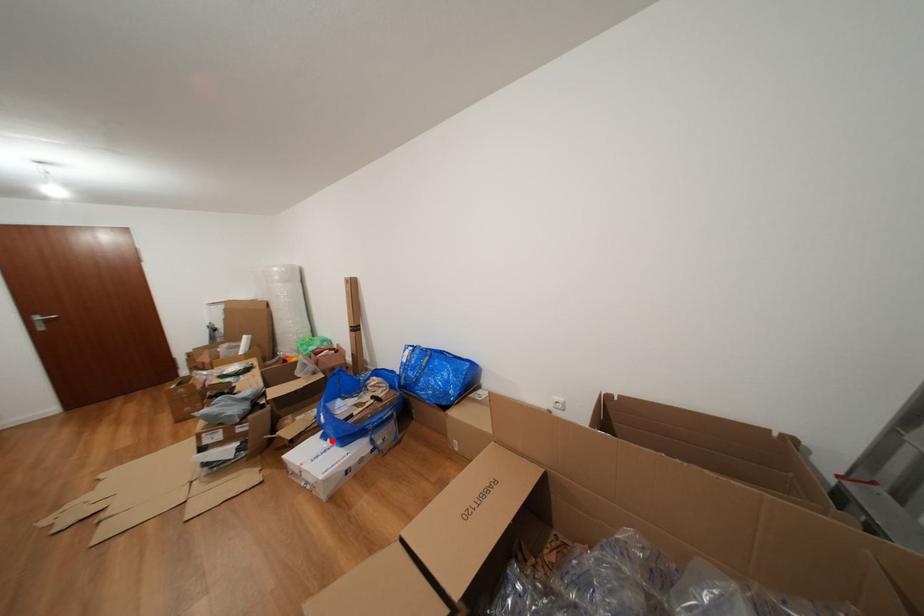
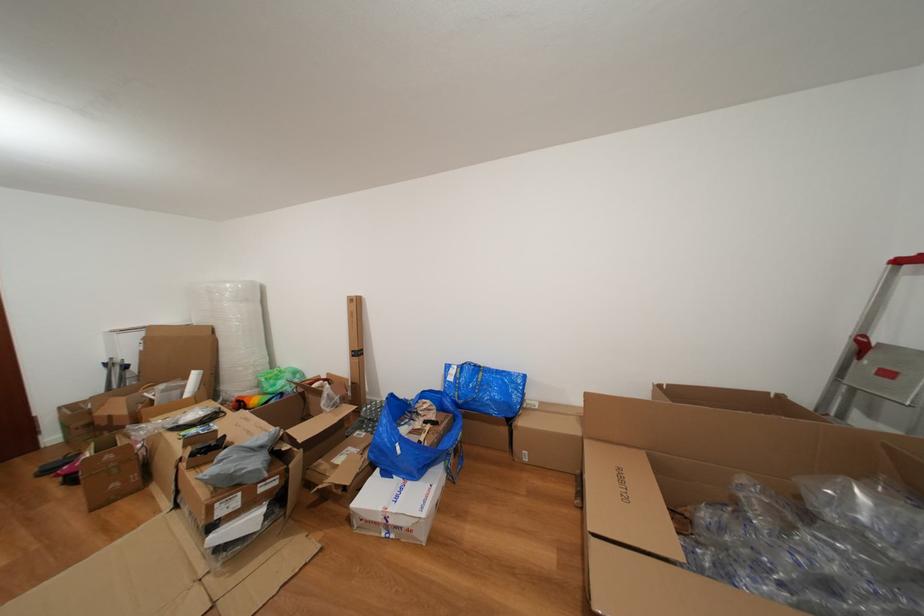
Locate, in the second image, the point that corresponds to the highlighted location in the first image.

(394, 479)